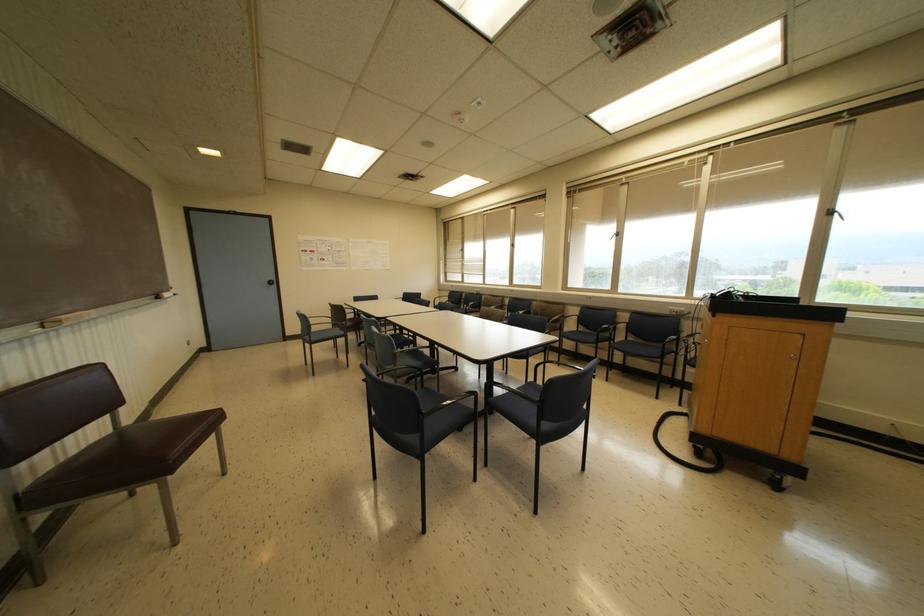
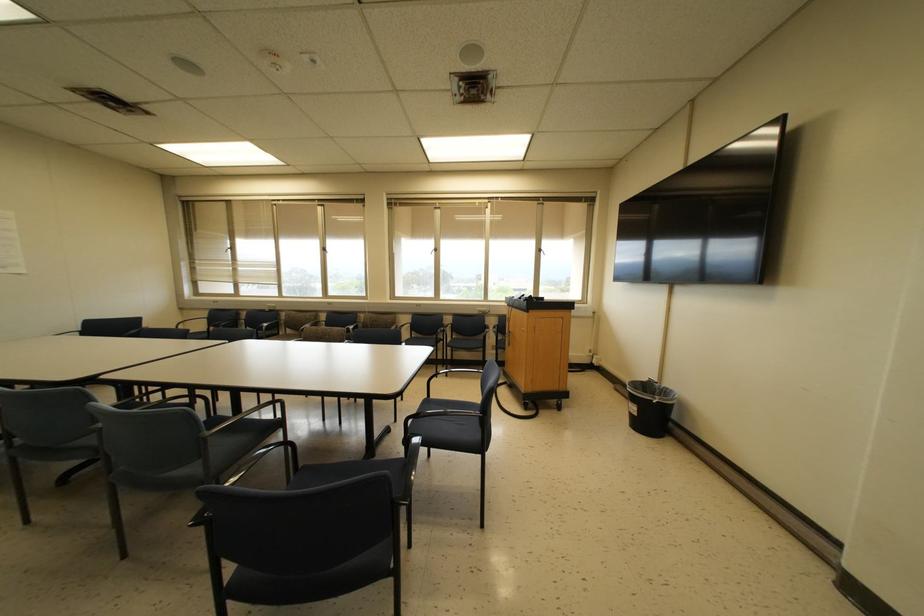
Question: The camera is either moving clockwise (left) or counter-clockwise (right) around the object. The first image is from the beginning of the video and the second image is from the end. Is the camera moving left or right when shooting the video?

Choices:
 (A) Left
 (B) Right

Answer: (A)